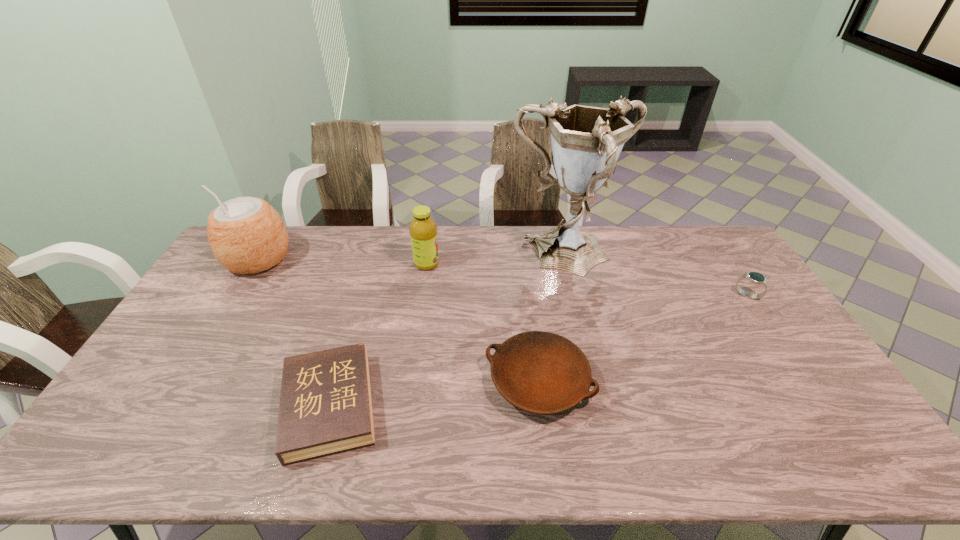
The width and height of the screenshot is (960, 540). In order to click on empty space that is in between the trophy cup and the shortest object in this screenshot , I will do `click(449, 332)`.

At what (x,y) coordinates should I click in order to perform the action: click on free spot between the leftmost object and the plate. Please return your answer as a coordinate pair (x, y). The image size is (960, 540). Looking at the image, I should click on coord(398,320).

The height and width of the screenshot is (540, 960). Identify the location of free point between the second object from left to right and the fruit juice. (378, 335).

The width and height of the screenshot is (960, 540). In order to click on blank region between the leftmost object and the shortest object in this screenshot , I will do `click(294, 333)`.

Where is `empty space between the shortest object and the fifth shortest object`? The width and height of the screenshot is (960, 540). empty space between the shortest object and the fifth shortest object is located at coordinates (294, 333).

Identify which object is located as the fifth nearest to the shortest object. Please provide its 2D coordinates. Your answer should be formatted as a tuple, i.e. [(x, y)], where the tuple contains the x and y coordinates of a point satisfying the conditions above.

[(754, 277)]

Locate which object ranks second in proximity to the third tallest object. Please provide its 2D coordinates. Your answer should be formatted as a tuple, i.e. [(x, y)], where the tuple contains the x and y coordinates of a point satisfying the conditions above.

[(539, 372)]

Image resolution: width=960 pixels, height=540 pixels. In order to click on vacant space that satisfies the following two spatial constraints: 1. on the front label of the third object from left to right; 2. on the right side of the rightmost object in this screenshot , I will do `click(422, 295)`.

Where is `vacant region that satisfies the following two spatial constraints: 1. on the front label of the fourth object from right to left; 2. on the front side of the second object from left to right`? This screenshot has height=540, width=960. vacant region that satisfies the following two spatial constraints: 1. on the front label of the fourth object from right to left; 2. on the front side of the second object from left to right is located at coordinates (406, 406).

What are the coordinates of `vacant space that satisfies the following two spatial constraints: 1. on the front label of the fourth shortest object; 2. on the left side of the plate` in the screenshot? It's located at (410, 381).